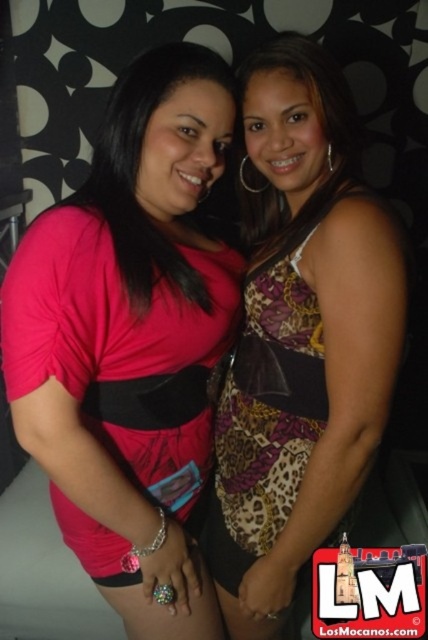
From the picture: You are standing in the middle of the room and want to hand a gift to the woman wearing the pink matte shirt at center. Based on the coordinates given, in which direction should you move to reach her?

The pink matte shirt at center is located at coordinates point (x=130, y=340), so you should move towards the center of the room to reach her.

You are at a party and want to take a photo of both the pink matte shirt at center and the leopard print dress at center. Which one should you focus on first if you want to capture them in order from top to bottom?

The pink matte shirt at center is above the leopard print dress at center, so you should focus on the pink matte shirt at center first to capture them from top to bottom.